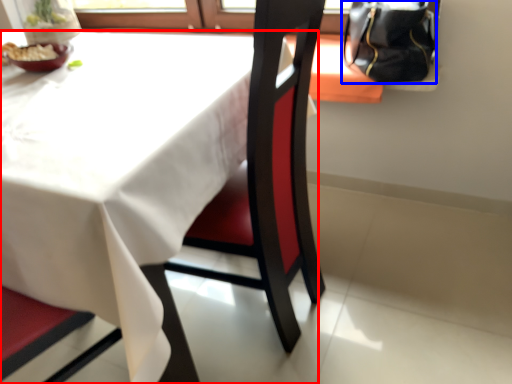
Question: Which point is closer to the camera, table (highlighted by a red box) or handbag (highlighted by a blue box)?

Choices:
 (A) table
 (B) handbag

Answer: (A)